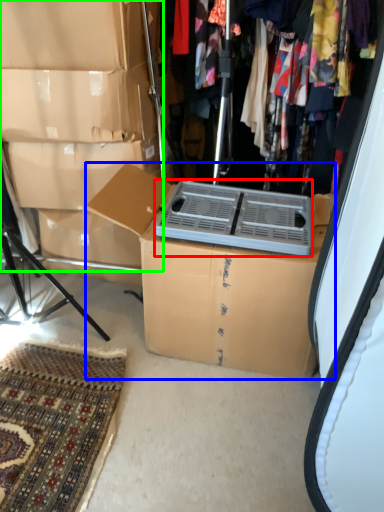
Question: Considering the real-world distances, which object is closest to appliance (highlighted by a red box)? box (highlighted by a blue box) or storage box (highlighted by a green box).

Choices:
 (A) box
 (B) storage box

Answer: (A)